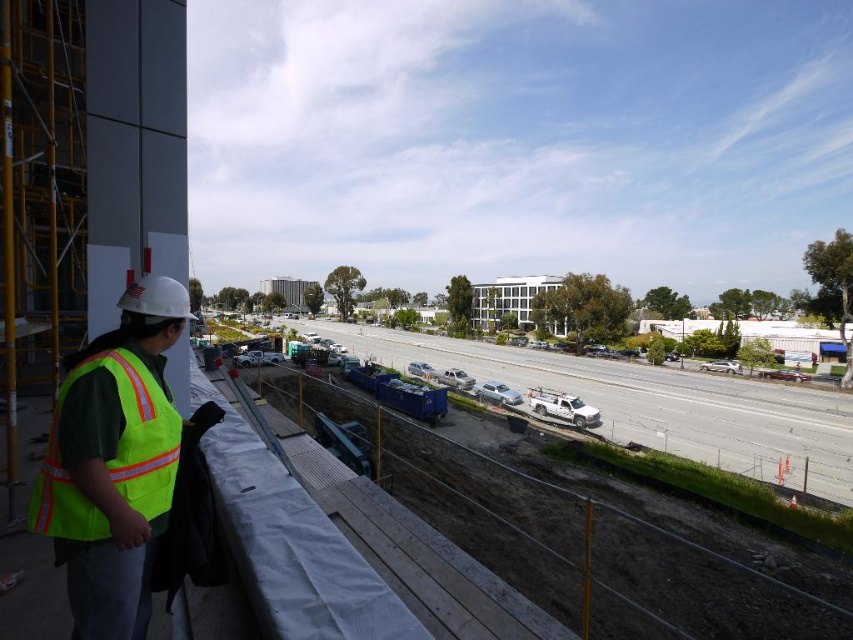
Between high visibility reflective vest at left and high-visibility reflective safety vest at left, which one appears on the left side from the viewer's perspective?

high visibility reflective vest at left is more to the left.

Describe the element at coordinates (113, 461) in the screenshot. I see `high visibility reflective vest at left` at that location.

From the picture: Measure the distance between point (115, 476) and camera.

Point (115, 476) and camera are 8.27 feet apart.

At what (x,y) coordinates should I click in order to perform the action: click on high visibility reflective vest at left. Please return your answer as a coordinate pair (x, y). Image resolution: width=853 pixels, height=640 pixels. Looking at the image, I should click on (113, 461).

Between dirt at lower center and high-visibility reflective safety vest at left, which one is positioned lower?

Positioned lower is dirt at lower center.

Which is more to the right, dirt at lower center or high-visibility reflective safety vest at left?

Positioned to the right is dirt at lower center.

This screenshot has width=853, height=640. What do you see at coordinates (606, 540) in the screenshot?
I see `dirt at lower center` at bounding box center [606, 540].

At what (x,y) coordinates should I click in order to perform the action: click on dirt at lower center. Please return your answer as a coordinate pair (x, y). Image resolution: width=853 pixels, height=640 pixels. Looking at the image, I should click on 606,540.

Between point (260, 394) and point (61, 410), which one is positioned in front?

Positioned in front is point (61, 410).

The width and height of the screenshot is (853, 640). What are the coordinates of `dirt at lower center` in the screenshot? It's located at (606, 540).

This screenshot has height=640, width=853. What are the coordinates of `dirt at lower center` in the screenshot? It's located at (606, 540).